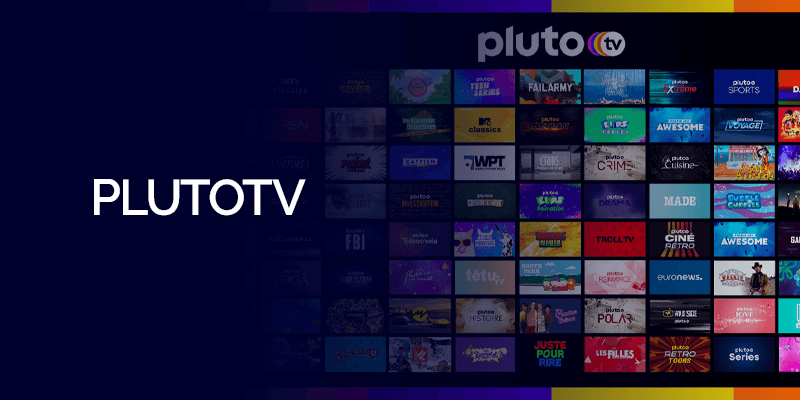
The height and width of the screenshot is (400, 800). Find the location of `yellow trim`. yellow trim is located at coordinates (710, 14).